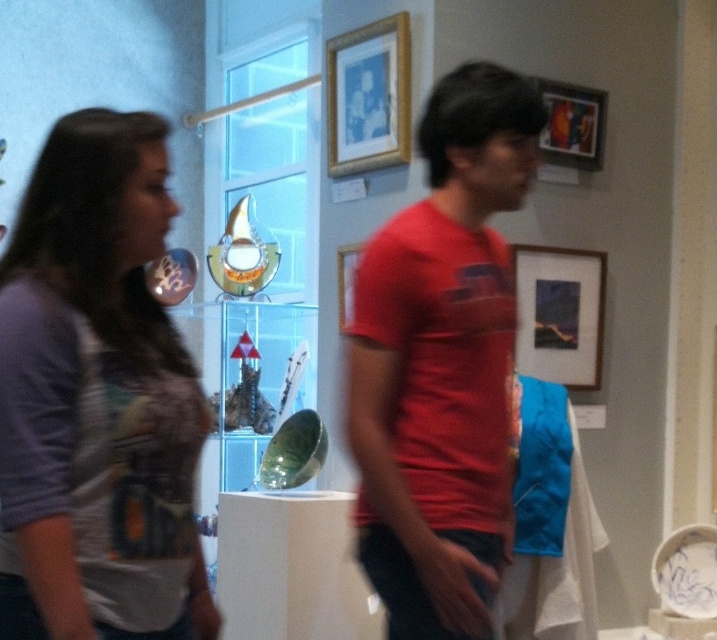
Question: Estimate the real-world distances between objects in this image. Which object is farther from the matte wooden picture frame at upper right?

Choices:
 (A) matte red t-shirt at center
 (B) red matte t-shirt at center

Answer: (A)

Question: Is matte purple t-shirt at left below matte wooden picture frame at upper right?

Choices:
 (A) yes
 (B) no

Answer: (A)

Question: Which of the following is the farthest from the observer?

Choices:
 (A) (77, 134)
 (B) (523, 342)
 (C) (348, 280)
 (D) (427, 544)

Answer: (C)

Question: Does matte purple t-shirt at left appear on the right side of gold-framed picture at upper center?

Choices:
 (A) yes
 (B) no

Answer: (B)

Question: Among these points, which one is nearest to the camera?

Choices:
 (A) (338, 248)
 (B) (174, 472)
 (C) (376, 61)

Answer: (B)

Question: Can you confirm if matte purple t-shirt at left is thinner than wooden picture frame at center?

Choices:
 (A) yes
 (B) no

Answer: (B)